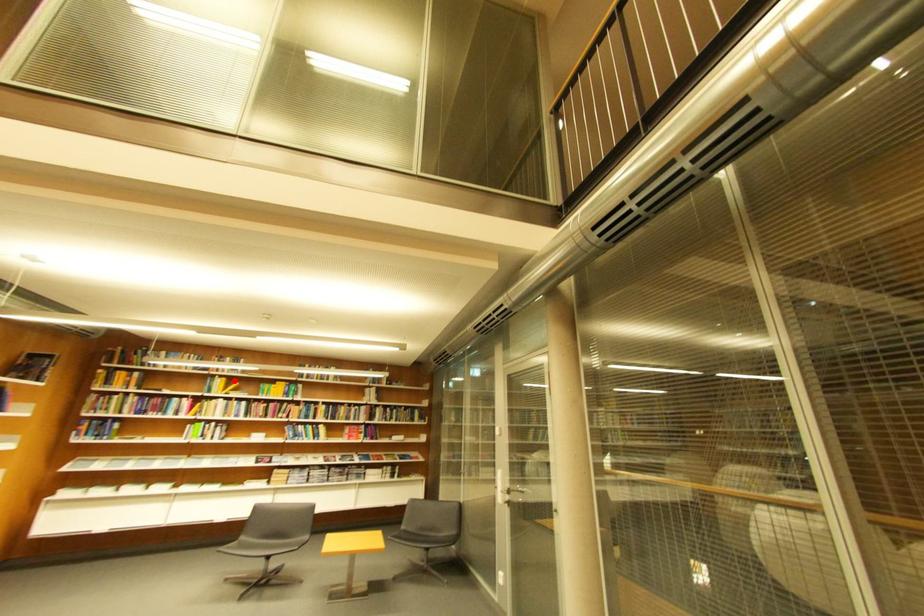
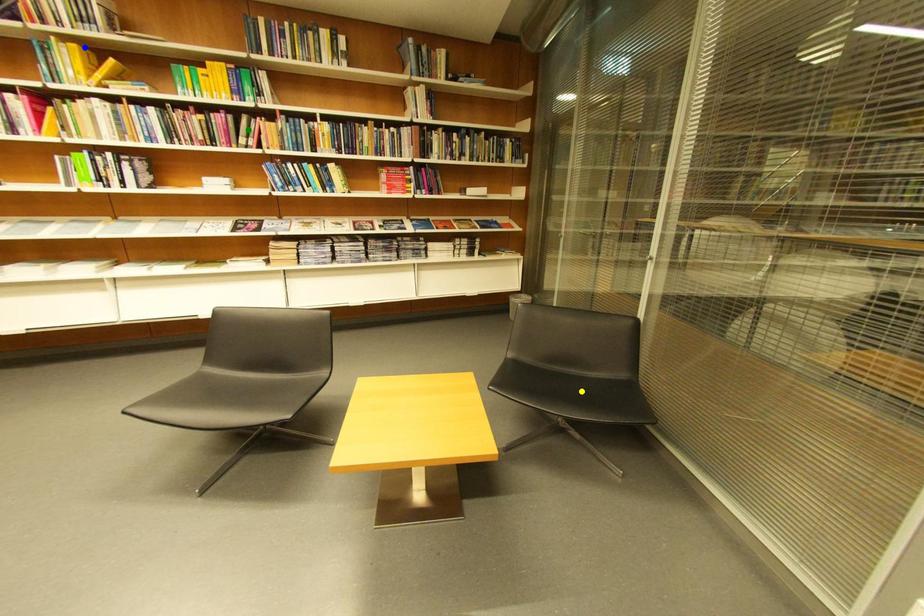
Question: I am providing you with two images of the same scene from different viewpoints. A red point is marked on the first image. You are given multiple points on the second image. Which mark in image 2 goes with the point in image 1?

Choices:
 (A) blue point
 (B) green point
 (C) yellow point

Answer: (A)